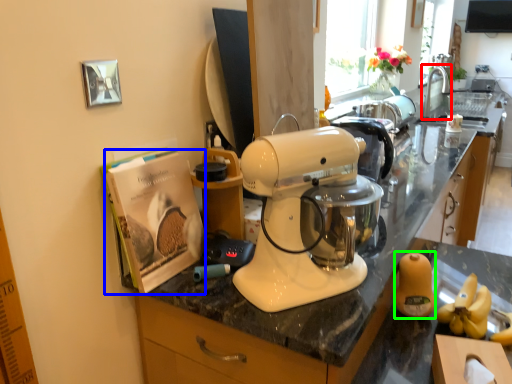
Question: Estimate the real-world distances between objects in this image. Which object is closer to faucet (highlighted by a red box), magazine (highlighted by a blue box) or food (highlighted by a green box)?

Choices:
 (A) magazine
 (B) food

Answer: (B)